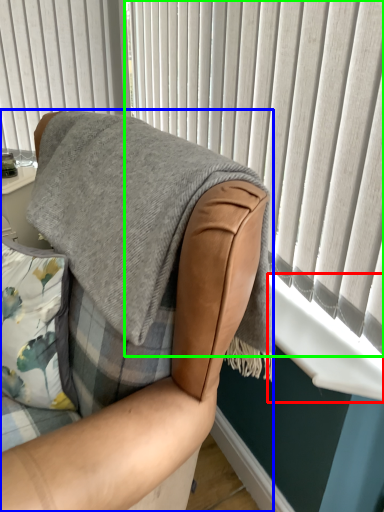
Question: Which object is positioned farthest from window sill (highlighted by a red box)? Select from chair (highlighted by a blue box) and curtain (highlighted by a green box).

Choices:
 (A) chair
 (B) curtain

Answer: (A)